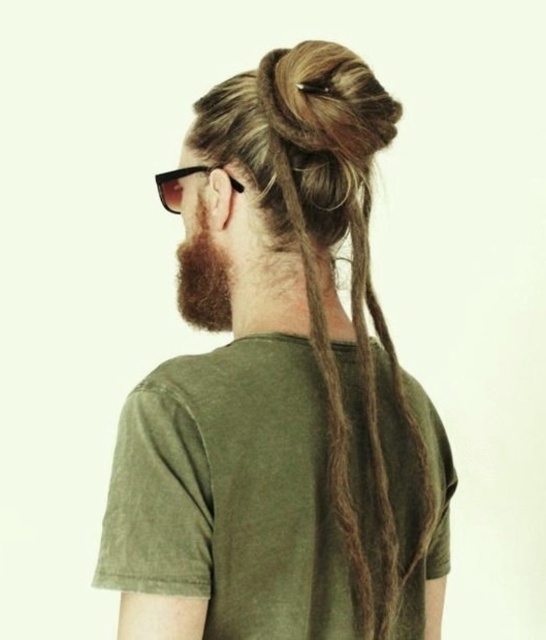
Question: Is brown matte hair at upper center closer to camera compared to dark brown fuzzy beard at center?

Choices:
 (A) yes
 (B) no

Answer: (A)

Question: Based on their relative distances, which object is nearer to the dark brown fuzzy beard at center?

Choices:
 (A) black plastic sunglasses at upper center
 (B) brown matte hair at upper center

Answer: (A)

Question: Which object appears farthest from the camera in this image?

Choices:
 (A) dark brown fuzzy beard at center
 (B) brown matte hair at upper center

Answer: (A)

Question: Does brown matte hair at upper center appear over dark brown fuzzy beard at center?

Choices:
 (A) yes
 (B) no

Answer: (B)

Question: Which of the following is the closest to the observer?

Choices:
 (A) dark brown fuzzy beard at center
 (B) brown matte hair at upper center

Answer: (B)

Question: Is brown matte hair at upper center behind black plastic sunglasses at upper center?

Choices:
 (A) yes
 (B) no

Answer: (B)